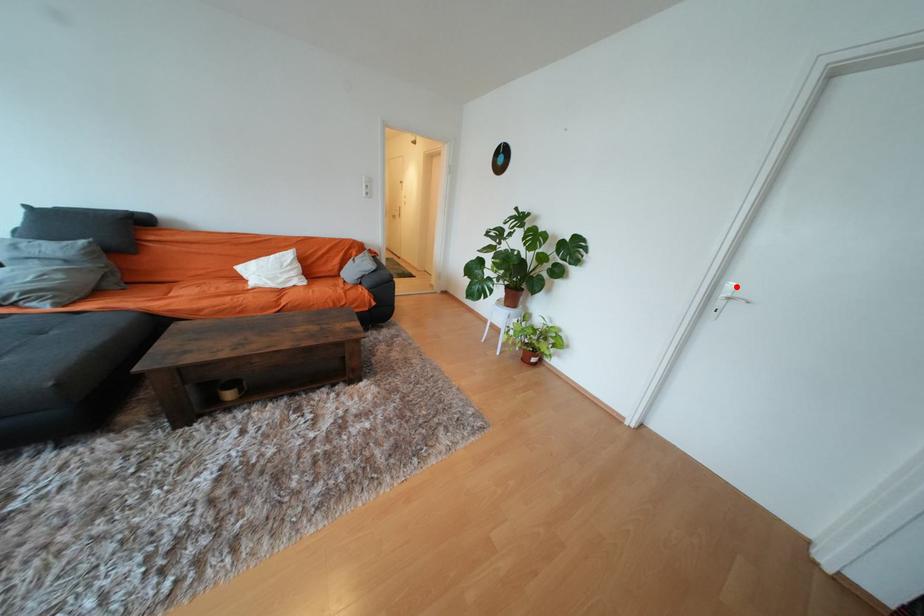
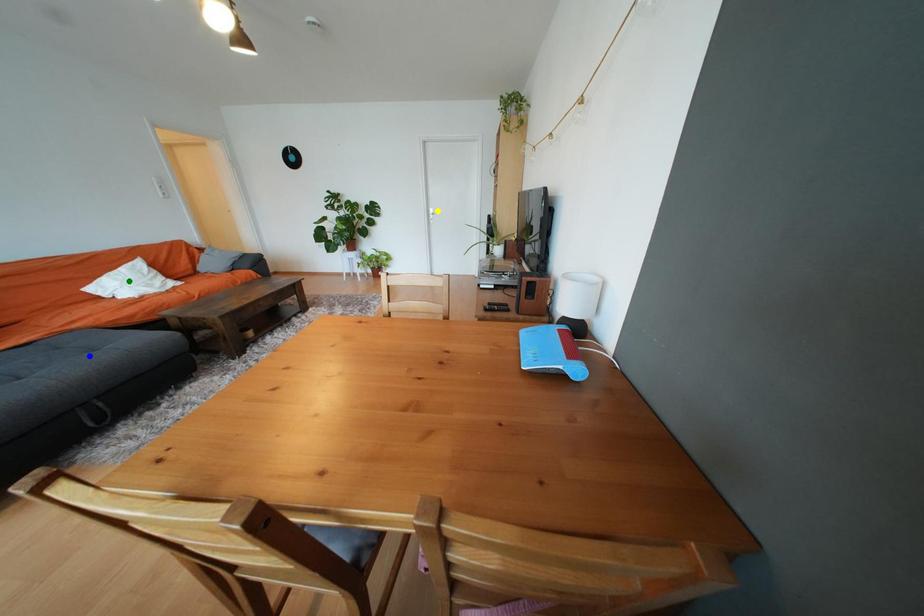
Question: I am providing you with two images of the same scene from different viewpoints. A red point is marked on the first image. You are given multiple points on the second image. Which spot in image 2 lines up with the point in image 1?

Choices:
 (A) yellow point
 (B) blue point
 (C) green point

Answer: (A)